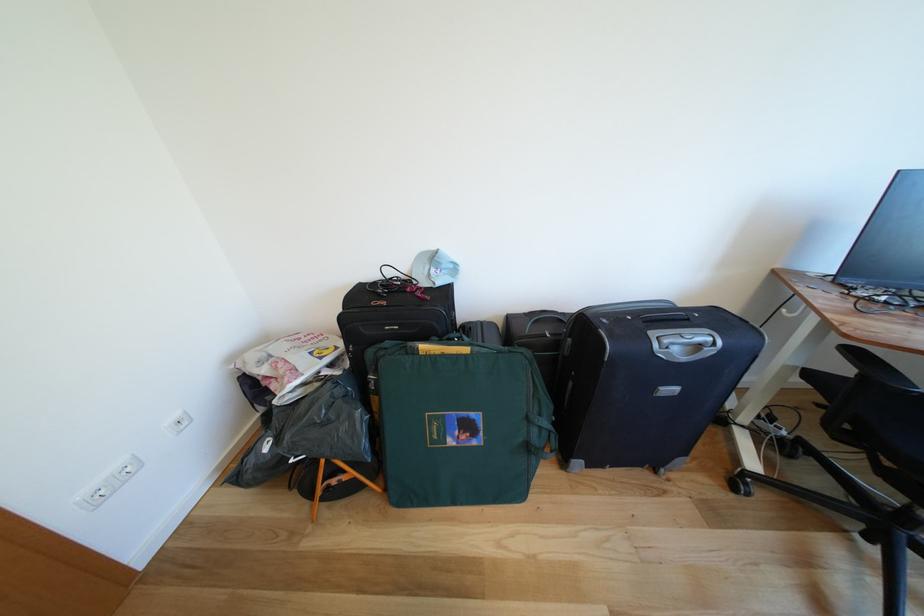
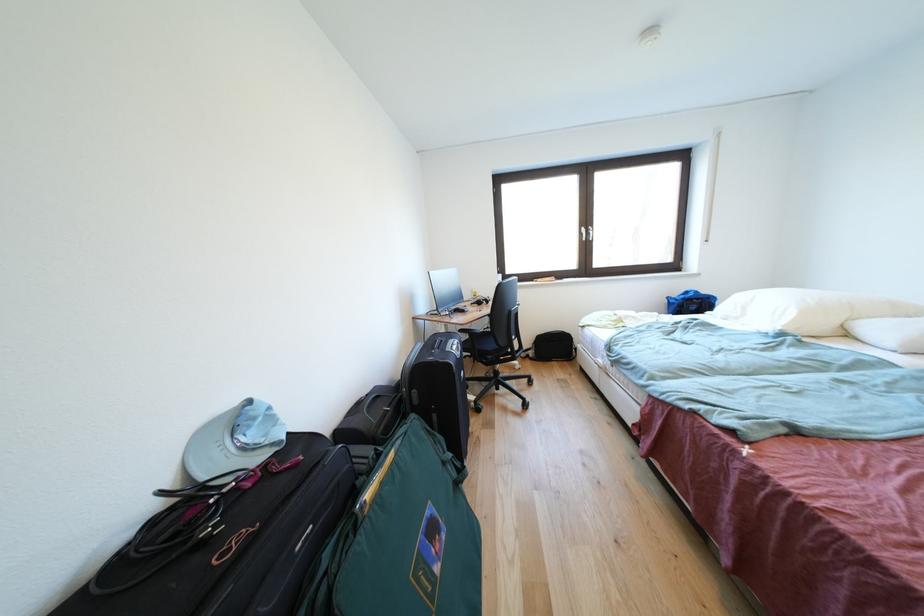
Question: The images are taken continuously from a first-person perspective. In which direction is your viewpoint rotating?

Choices:
 (A) Left
 (B) Right
 (C) Up
 (D) Down

Answer: (B)